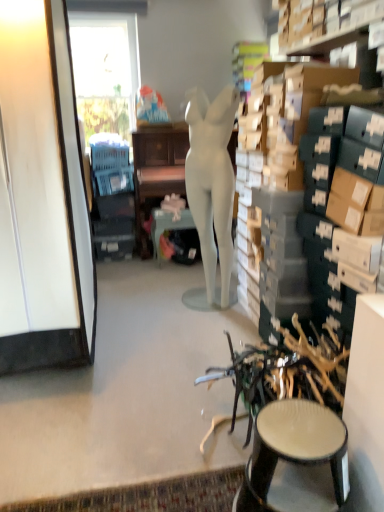
Question: Could white glossy cabinet at left be considered to be inside metallic teal table at center?

Choices:
 (A) yes
 (B) no

Answer: (B)

Question: From a real-world perspective, is metallic teal table at center positioned under white glossy cabinet at left based on gravity?

Choices:
 (A) no
 (B) yes

Answer: (B)

Question: Considering the relative sizes of metallic teal table at center and white glossy cabinet at left in the image provided, is metallic teal table at center taller than white glossy cabinet at left?

Choices:
 (A) yes
 (B) no

Answer: (B)

Question: Is metallic teal table at center positioned with its back to white glossy cabinet at left?

Choices:
 (A) yes
 (B) no

Answer: (B)

Question: Is metallic teal table at center at the right side of white glossy cabinet at left?

Choices:
 (A) yes
 (B) no

Answer: (A)

Question: Looking at their shapes, would you say matte white mannequin at center is wider or thinner than matte white desk at center?

Choices:
 (A) thin
 (B) wide

Answer: (A)

Question: Would you say matte white mannequin at center is to the left or to the right of matte white desk at center in the picture?

Choices:
 (A) left
 (B) right

Answer: (B)

Question: From a real-world perspective, is matte white mannequin at center positioned above or below matte white desk at center?

Choices:
 (A) below
 (B) above

Answer: (B)

Question: Is matte white mannequin at center taller or shorter than matte white desk at center?

Choices:
 (A) short
 (B) tall

Answer: (B)

Question: Considering the positions of matte black stool at lower right and white glossy cabinet at left in the image, is matte black stool at lower right taller or shorter than white glossy cabinet at left?

Choices:
 (A) tall
 (B) short

Answer: (B)

Question: Based on their positions, is matte black stool at lower right located to the left or right of white glossy cabinet at left?

Choices:
 (A) right
 (B) left

Answer: (A)

Question: In terms of size, does matte black stool at lower right appear bigger or smaller than white glossy cabinet at left?

Choices:
 (A) big
 (B) small

Answer: (B)

Question: Is point (296, 501) positioned closer to the camera than point (1, 44)?

Choices:
 (A) farther
 (B) closer

Answer: (B)

Question: Considering the positions of point (228, 208) and point (155, 219), is point (228, 208) closer or farther from the camera than point (155, 219)?

Choices:
 (A) farther
 (B) closer

Answer: (B)

Question: Considering the positions of matte white mannequin at center and metallic teal table at center in the image, is matte white mannequin at center bigger or smaller than metallic teal table at center?

Choices:
 (A) small
 (B) big

Answer: (B)